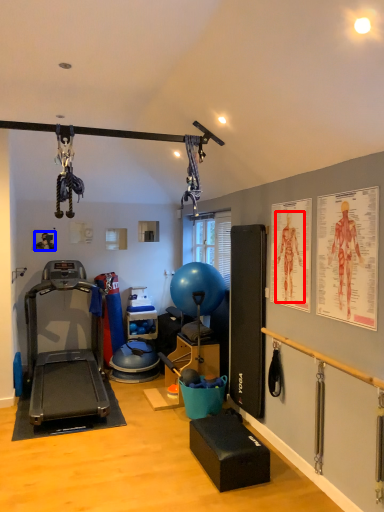
Question: Which point is closer to the camera, person (highlighted by a red box) or person (highlighted by a blue box)?

Choices:
 (A) person
 (B) person

Answer: (A)